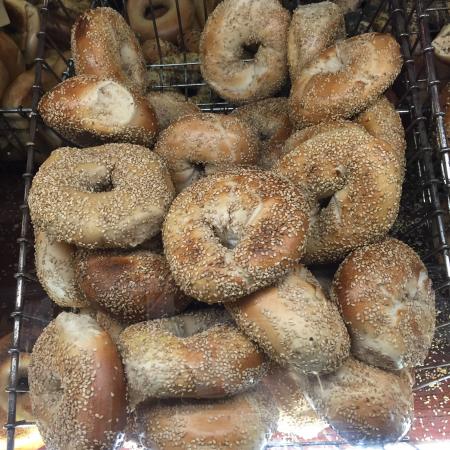
Where is `metal wires steel basket`? metal wires steel basket is located at coordinates (430, 255), (440, 290), (27, 318), (21, 422), (443, 378), (410, 128), (52, 39), (24, 241).